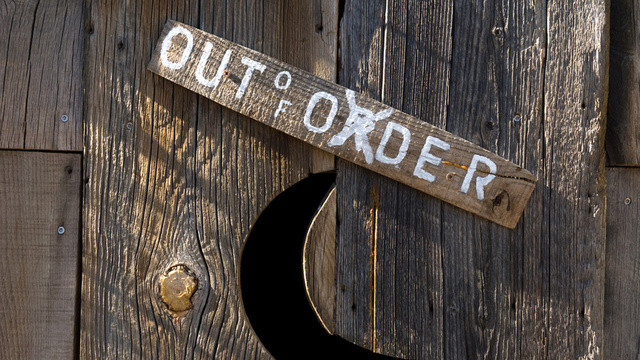
Identify the location of split in wooden door. This screenshot has width=640, height=360. (385, 77), (378, 260).